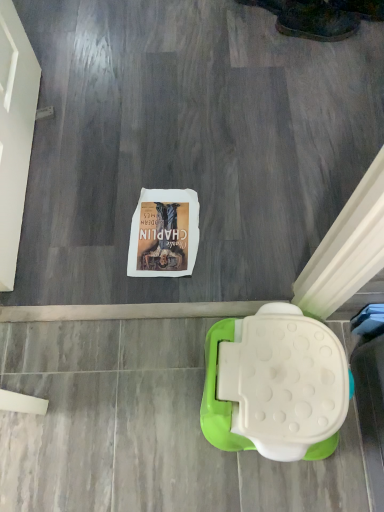
Describe the element at coordinates (316, 20) in the screenshot. The height and width of the screenshot is (512, 384). I see `leather boot at upper right` at that location.

Find the location of a particular element. This screenshot has width=384, height=512. leather boot at upper right is located at coordinates (316, 20).

At what (x,y) coordinates should I click in order to perform the action: click on white plastic toilet at lower right. Please return your answer as a coordinate pair (x, y). Image resolution: width=384 pixels, height=512 pixels. Looking at the image, I should click on (275, 385).

Describe the element at coordinates (275, 385) in the screenshot. The height and width of the screenshot is (512, 384). I see `white plastic toilet at lower right` at that location.

This screenshot has height=512, width=384. I want to click on leather boot at upper right, so click(316, 20).

Which is more to the left, leather boot at upper right or white plastic toilet at lower right?

From the viewer's perspective, white plastic toilet at lower right appears more on the left side.

Does leather boot at upper right lie behind white plastic toilet at lower right?

Yes, it is.

Between point (285, 14) and point (244, 332), which one is positioned behind?

Positioned behind is point (285, 14).

From the image's perspective, between leather boot at upper right and white plastic toilet at lower right, who is located below?

white plastic toilet at lower right, from the image's perspective.

From a real-world perspective, is leather boot at upper right below white plastic toilet at lower right?

Yes, from a real-world perspective, leather boot at upper right is below white plastic toilet at lower right.

Considering the relative sizes of leather boot at upper right and white plastic toilet at lower right in the image provided, is leather boot at upper right wider than white plastic toilet at lower right?

No.

Considering the relative sizes of leather boot at upper right and white plastic toilet at lower right in the image provided, is leather boot at upper right shorter than white plastic toilet at lower right?

Yes, leather boot at upper right is shorter than white plastic toilet at lower right.

In terms of size, does leather boot at upper right appear bigger or smaller than white plastic toilet at lower right?

Clearly, leather boot at upper right is smaller in size than white plastic toilet at lower right.

Looking at this image, is white plastic toilet at lower right a part of leather boot at upper right?

That's incorrect, white plastic toilet at lower right is not inside leather boot at upper right.

Is leather boot at upper right positioned far away from white plastic toilet at lower right?

That's right, there is a large distance between leather boot at upper right and white plastic toilet at lower right.

Is leather boot at upper right oriented towards white plastic toilet at lower right?

Yes, leather boot at upper right is aimed at white plastic toilet at lower right.

How many degrees apart are the facing directions of leather boot at upper right and white plastic toilet at lower right?

→ There is a 80.8-degree angle between the facing directions of leather boot at upper right and white plastic toilet at lower right.

How far apart are leather boot at upper right and white plastic toilet at lower right?

A distance of 1.24 meters exists between leather boot at upper right and white plastic toilet at lower right.

The width and height of the screenshot is (384, 512). What are the coordinates of `toilet below the leather boot at upper right (from the image's perspective)` in the screenshot? It's located at (275, 385).

Would you say white plastic toilet at lower right is to the left or to the right of leather boot at upper right in the picture?

Clearly, white plastic toilet at lower right is on the left of leather boot at upper right in the image.

Is white plastic toilet at lower right closer to camera compared to leather boot at upper right?

Yes, white plastic toilet at lower right is closer to the camera.

Does point (230, 364) come behind point (294, 32)?

No, it is not.

From the image's perspective, which one is positioned higher, white plastic toilet at lower right or leather boot at upper right?

leather boot at upper right is shown above in the image.

From a real-world perspective, which object rests below the other?

leather boot at upper right.

Consider the image. Which object is wider, white plastic toilet at lower right or leather boot at upper right?

Wider between the two is white plastic toilet at lower right.

Considering the relative sizes of white plastic toilet at lower right and leather boot at upper right in the image provided, is white plastic toilet at lower right taller than leather boot at upper right?

Yes.

Can you confirm if white plastic toilet at lower right is bigger than leather boot at upper right?

Indeed, white plastic toilet at lower right has a larger size compared to leather boot at upper right.

Is white plastic toilet at lower right not inside leather boot at upper right?

Yes.

Are white plastic toilet at lower right and leather boot at upper right beside each other?

No, white plastic toilet at lower right is not making contact with leather boot at upper right.

Is white plastic toilet at lower right facing towards leather boot at upper right?

No, white plastic toilet at lower right is not aimed at leather boot at upper right.

What's the angular difference between white plastic toilet at lower right and leather boot at upper right's facing directions?

80.8 degrees separate the facing orientations of white plastic toilet at lower right and leather boot at upper right.

At what (x,y) coordinates should I click in order to perform the action: click on toilet located in front of the leather boot at upper right. Please return your answer as a coordinate pair (x, y). Looking at the image, I should click on (275, 385).

This screenshot has width=384, height=512. In order to click on toilet lying below the leather boot at upper right (from the image's perspective) in this screenshot , I will do `click(275, 385)`.

Locate an element on the screen. The width and height of the screenshot is (384, 512). toilet located in front of the leather boot at upper right is located at coordinates (275, 385).